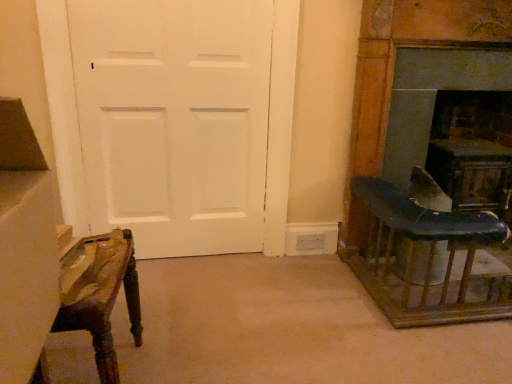
In order to face dark gray stone fireplace at right, should I rotate leftwards or rightwards?

You should look right and rotate roughly 24.564 degrees.

Image resolution: width=512 pixels, height=384 pixels. Find the location of `wooden chair at right`. wooden chair at right is located at coordinates (426, 256).

Is white matte door at left a part of wooden chair at right?

No, white matte door at left is not a part of wooden chair at right.

Could you tell me if wooden chair at right is turned towards white matte door at left?

No, wooden chair at right is not oriented towards white matte door at left.

Considering the positions of objects wooden chair at right and white matte door at left in the image provided, who is behind, wooden chair at right or white matte door at left?

white matte door at left is further away from the camera.

From the image's perspective, is wooden chair at right located above white matte door at left?

No, from the image's perspective, wooden chair at right is not on top of white matte door at left.

Find the location of `screen door in front of the dark gray stone fireplace at right`. screen door in front of the dark gray stone fireplace at right is located at coordinates (174, 120).

What's the angular difference between white matte door at left and dark gray stone fireplace at right's facing directions?

The facing directions of white matte door at left and dark gray stone fireplace at right are 1.99 degrees apart.

Could you tell me if white matte door at left is facing dark gray stone fireplace at right?

No, white matte door at left is not aimed at dark gray stone fireplace at right.

Which is behind, point (178, 239) or point (418, 83)?

The point (178, 239) is behind.

Does blue leather chair at right have a smaller size compared to white matte door at left?

Incorrect, blue leather chair at right is not smaller in size than white matte door at left.

Is blue leather chair at right next to white matte door at left?

No.

Does blue leather chair at right appear on the right side of white matte door at left?

Yes.

At what (x,y) coordinates should I click in order to perform the action: click on screen door on the left of blue leather chair at right. Please return your answer as a coordinate pair (x, y). The height and width of the screenshot is (384, 512). Looking at the image, I should click on (174, 120).

Consider the image. Considering their positions, is white matte door at left located in front of or behind blue leather chair at right?

In the image, white matte door at left appears in front of blue leather chair at right.

Is point (168, 14) more distant than point (407, 313)?

That is True.

In order to click on screen door that appears in front of the blue leather chair at right in this screenshot , I will do `click(174, 120)`.

Is dark gray stone fireplace at right thinner than white matte door at left?

In fact, dark gray stone fireplace at right might be wider than white matte door at left.

Considering the relative sizes of dark gray stone fireplace at right and white matte door at left in the image provided, is dark gray stone fireplace at right shorter than white matte door at left?

Yes.

From the image's perspective, is dark gray stone fireplace at right above or below white matte door at left?

Based on their image positions, dark gray stone fireplace at right is located beneath white matte door at left.

Is dark gray stone fireplace at right beside white matte door at left?

dark gray stone fireplace at right and white matte door at left are clearly separated.

Who is shorter, dark gray stone fireplace at right or blue leather chair at right?

dark gray stone fireplace at right is shorter.

From the image's perspective, would you say dark gray stone fireplace at right is shown under blue leather chair at right?

Yes, from the image's perspective, dark gray stone fireplace at right is below blue leather chair at right.

In terms of size, does dark gray stone fireplace at right appear bigger or smaller than blue leather chair at right?

Considering their sizes, dark gray stone fireplace at right takes up more space than blue leather chair at right.

Is dark gray stone fireplace at right to the right of blue leather chair at right from the viewer's perspective?

Indeed, dark gray stone fireplace at right is positioned on the right side of blue leather chair at right.

Looking at the image, does white matte door at left seem bigger or smaller compared to wooden chair at right?

Considering their sizes, white matte door at left takes up less space than wooden chair at right.

The width and height of the screenshot is (512, 384). I want to click on screen door above the wooden chair at right (from the image's perspective), so click(174, 120).

Is white matte door at left directly adjacent to wooden chair at right?

No, white matte door at left is not beside wooden chair at right.

Can you confirm if white matte door at left is wider than wooden chair at right?

No.

The height and width of the screenshot is (384, 512). I want to click on table that appears below the white matte door at left (from a real-world perspective), so click(x=426, y=256).

Locate an element on the screen. This screenshot has width=512, height=384. screen door on the left of dark gray stone fireplace at right is located at coordinates (174, 120).

Looking at the image, which one is located closer to white matte door at left, blue leather chair at right or dark gray stone fireplace at right?

Among the two, blue leather chair at right is located nearer to white matte door at left.

Considering their positions, is blue leather chair at right positioned further to wooden chair at right than white matte door at left?

white matte door at left lies further to wooden chair at right than the other object.

Considering their positions, is white matte door at left positioned closer to dark gray stone fireplace at right than wooden chair at right?

The object closer to dark gray stone fireplace at right is wooden chair at right.

From the image, which object appears to be farther from wooden chair at right, dark gray stone fireplace at right or blue leather chair at right?

The object further to wooden chair at right is dark gray stone fireplace at right.

Based on their spatial positions, is dark gray stone fireplace at right or white matte door at left further from wooden chair at right?

white matte door at left is further to wooden chair at right.

When comparing their distances from dark gray stone fireplace at right, does blue leather chair at right or white matte door at left seem further?

white matte door at left is positioned further to the anchor dark gray stone fireplace at right.

Estimate the real-world distances between objects in this image. Which object is further from white matte door at left, blue leather chair at right or wooden chair at right?

wooden chair at right is further to white matte door at left.

From the image, which object appears to be nearer to dark gray stone fireplace at right, wooden chair at right or blue leather chair at right?

Among the two, blue leather chair at right is located nearer to dark gray stone fireplace at right.

Image resolution: width=512 pixels, height=384 pixels. Identify the location of table between white matte door at left and dark gray stone fireplace at right in the horizontal direction. (426, 256).

Where is `furniture between white matte door at left and dark gray stone fireplace at right from left to right`? Image resolution: width=512 pixels, height=384 pixels. furniture between white matte door at left and dark gray stone fireplace at right from left to right is located at coordinates (410, 46).

At what (x,y) coordinates should I click in order to perform the action: click on table located between white matte door at left and blue leather chair at right in the left-right direction. Please return your answer as a coordinate pair (x, y). This screenshot has height=384, width=512. Looking at the image, I should click on (426, 256).

I want to click on furniture between wooden chair at right and dark gray stone fireplace at right along the z-axis, so click(x=410, y=46).